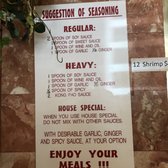
You are a GUI agent. You are given a task and a screenshot of the screen. Output one action in this format:
    pyautogui.click(x=<x>, y=<y>)
    Task: Click on the plant
    The image size is (168, 168).
    Given the screenshot: What is the action you would take?
    pyautogui.click(x=24, y=18)